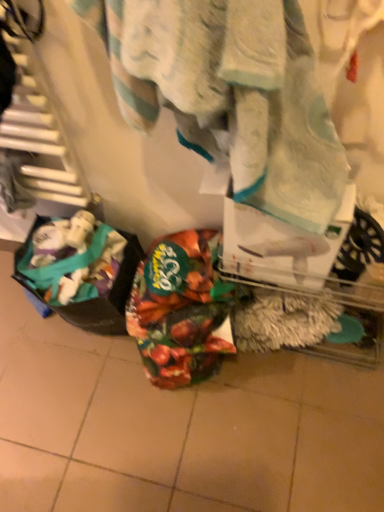
Question: Based on their sizes in the image, would you say white textured towel at center is bigger or smaller than shiny metallic bag at center, the first waste viewed from the right?

Choices:
 (A) big
 (B) small

Answer: (A)

Question: From the image's perspective, is white textured towel at center above or below shiny metallic bag at center, the second waste viewed from the left?

Choices:
 (A) below
 (B) above

Answer: (B)

Question: Estimate the real-world distances between objects in this image. Which object is closer to the white textured towel at center?

Choices:
 (A) shiny metallic bag at center, the first waste viewed from the right
 (B) plastic bag at lower left, the 2th waste from the right

Answer: (A)

Question: Which object is positioned closest to the white textured towel at center?

Choices:
 (A) plastic bag at lower left, marked as the first waste in a left-to-right arrangement
 (B) shiny metallic bag at center, the first waste viewed from the right

Answer: (B)